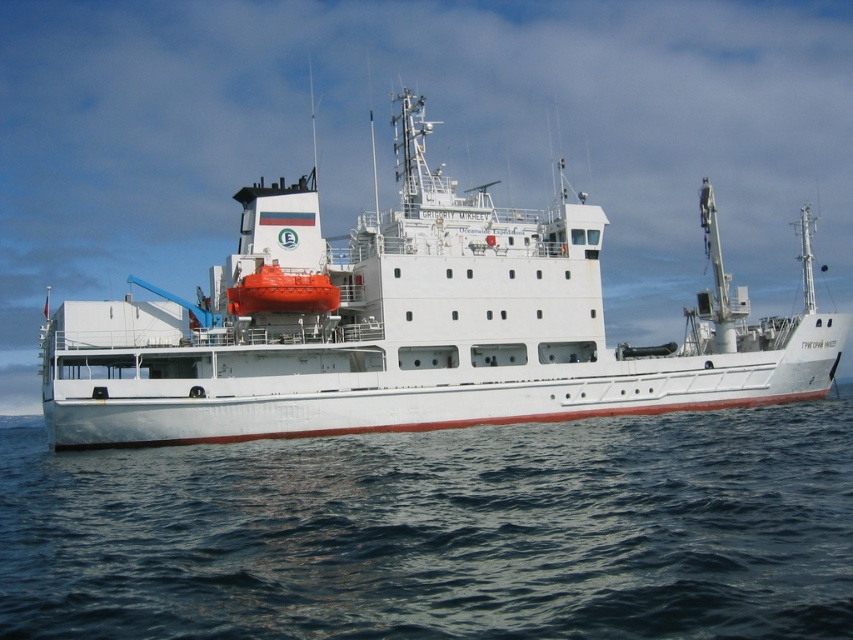
Who is lower down, blue water at lower center or white matte ship at center?

blue water at lower center is below.

Who is positioned more to the right, blue water at lower center or white matte ship at center?

blue water at lower center is more to the right.

At what (x,y) coordinates should I click in order to perform the action: click on blue water at lower center. Please return your answer as a coordinate pair (x, y). The width and height of the screenshot is (853, 640). Looking at the image, I should click on (442, 531).